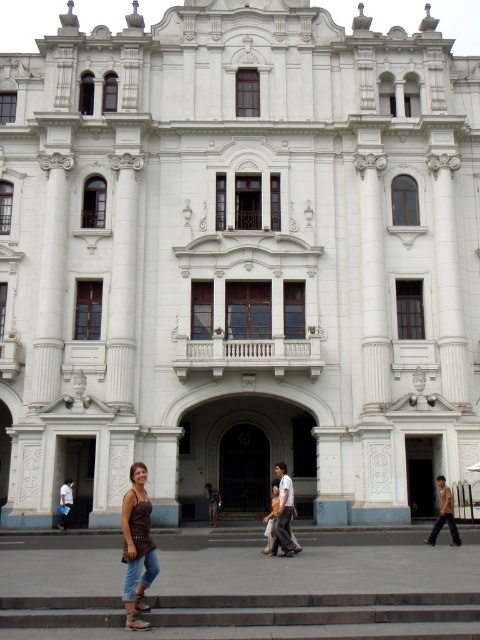
Can you confirm if brown leather tank top at center is positioned above white cotton shirt at lower left?

Correct, brown leather tank top at center is located above white cotton shirt at lower left.

Looking at this image, is brown leather tank top at center below white cotton shirt at lower left?

No.

You are a GUI agent. You are given a task and a screenshot of the screen. Output one action in this format:
    pyautogui.click(x=<x>, y=<y>)
    Task: Click on the brown leather tank top at center
    Image resolution: width=480 pixels, height=640 pixels.
    Given the screenshot: What is the action you would take?
    pyautogui.click(x=136, y=547)

Which of these two, white cotton shirt at lower left or denim pants at center, stands taller?

Standing taller between the two is denim pants at center.

Between white cotton shirt at lower left and denim pants at center, which one is positioned lower?

Positioned lower is denim pants at center.

Is point (68, 502) positioned after point (214, 492)?

That is False.

You are a GUI agent. You are given a task and a screenshot of the screen. Output one action in this format:
    pyautogui.click(x=<x>, y=<y>)
    Task: Click on the white cotton shirt at lower left
    The image size is (480, 640).
    Given the screenshot: What is the action you would take?
    pyautogui.click(x=64, y=502)

Can you confirm if dark gray stone stairs at lower center is positioned to the left of light brown leather jacket at lower right?

Yes, dark gray stone stairs at lower center is to the left of light brown leather jacket at lower right.

Locate an element on the screen. The height and width of the screenshot is (640, 480). dark gray stone stairs at lower center is located at coordinates (324, 614).

Where is `dark gray stone stairs at lower center`? Image resolution: width=480 pixels, height=640 pixels. dark gray stone stairs at lower center is located at coordinates (324, 614).